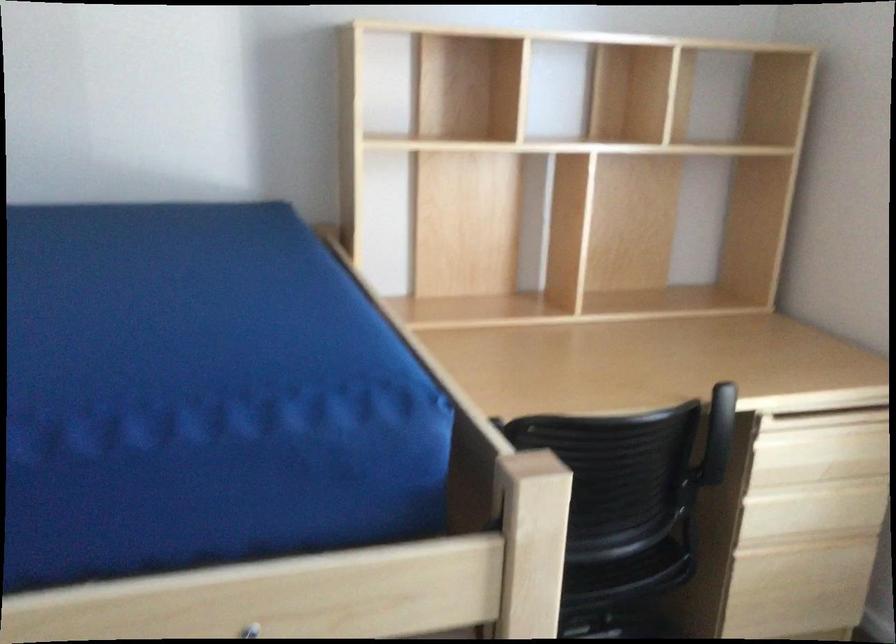
Identify the location of chair sitting surface. The width and height of the screenshot is (896, 644). (625, 576).